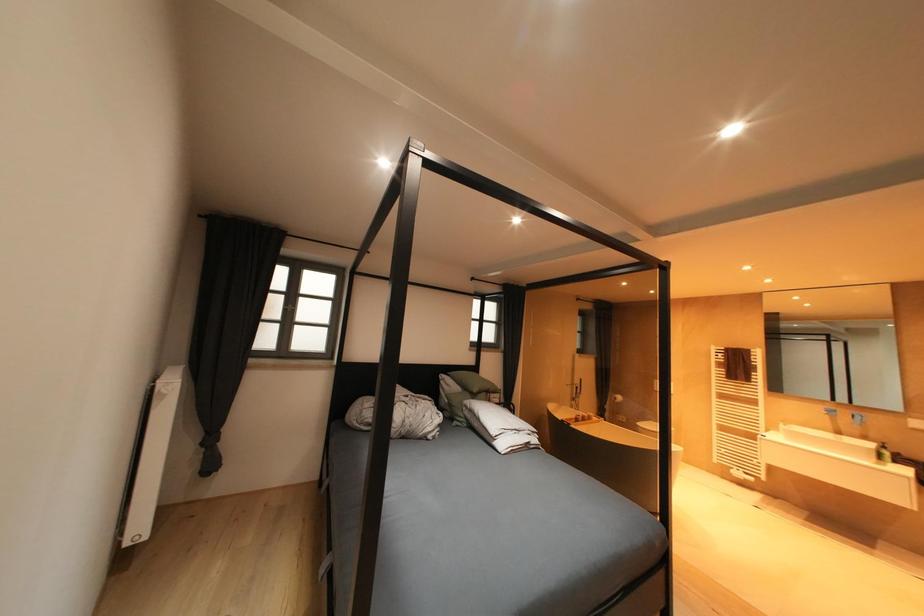
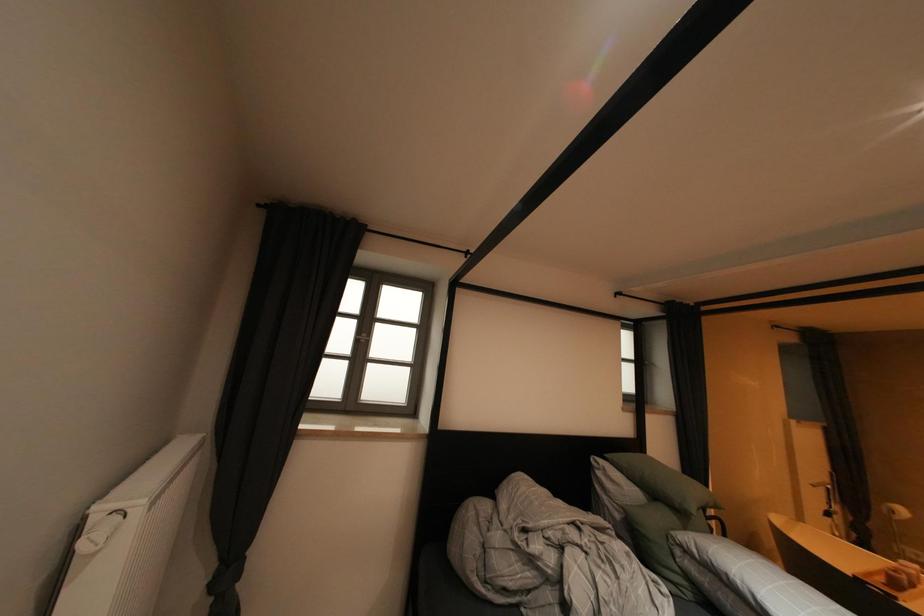
Consider the image. What movement of the cameraman would produce the second image?

The cameraman moved toward left, forward.